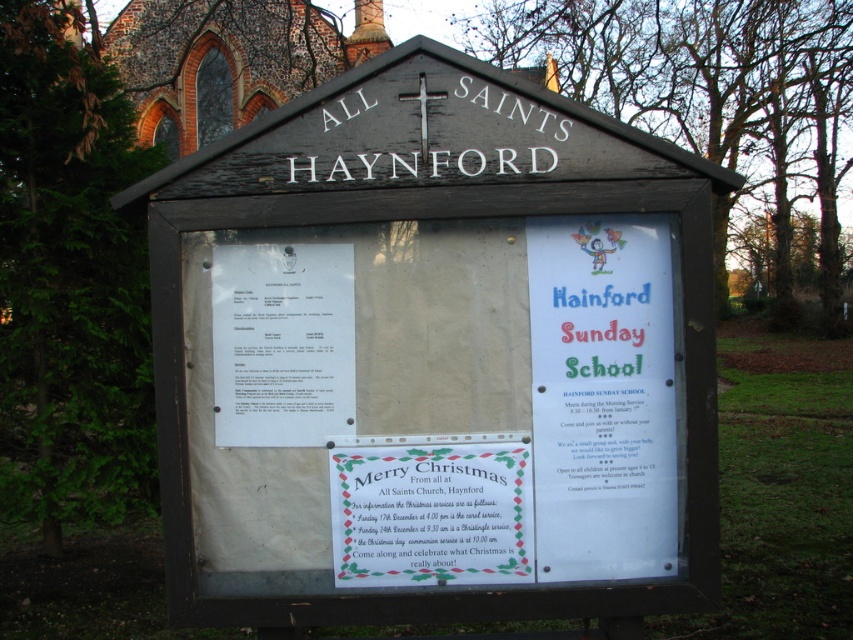
What is located at the point with coordinates (430, 509) on the noticeboard?

The point (430, 509) on the noticeboard corresponds to the white paper sign at center.

You are an event organizer who needs to hang a new announcement on the wooden noticeboard. You have two options to choose from, the white paper poster at center and the white paper sign at center. Which one should you choose if you want to display something taller?

The white paper poster at center has a greater height compared to the white paper sign at center, so you should choose the white paper poster at center to display something taller.

What is the exact coordinate of the white paper poster at center?

The white paper poster at center is located at point (602,397).